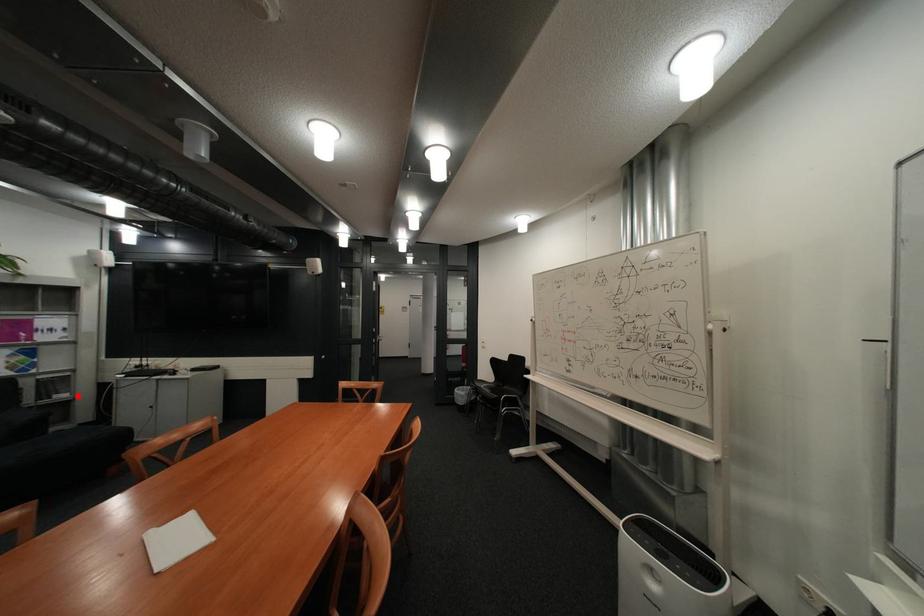
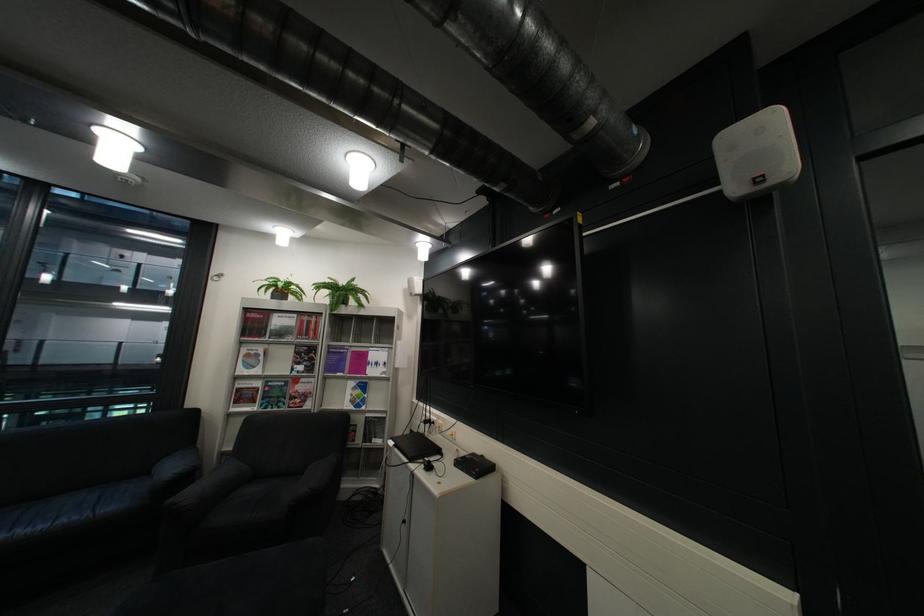
Locate, in the second image, the point that corresponds to the highlighted location in the first image.

(393, 442)